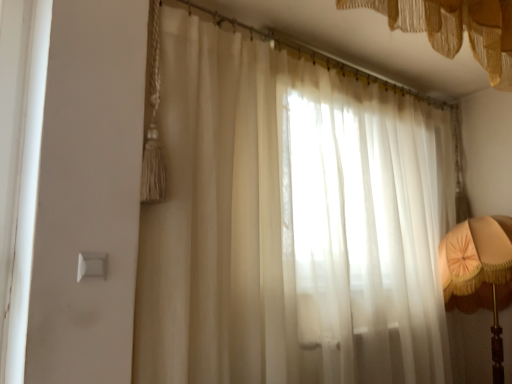
Question: Could you tell me if white plastic light switch at lower left is turned towards sheer white curtain at center, the 1th curtain from the bottom?

Choices:
 (A) yes
 (B) no

Answer: (B)

Question: From the image's perspective, is white plastic light switch at lower left located beneath sheer white curtain at center, the 1th curtain from the bottom?

Choices:
 (A) no
 (B) yes

Answer: (B)

Question: Would you say white plastic light switch at lower left is a long distance from sheer white curtain at center, the 1th curtain from the bottom?

Choices:
 (A) yes
 (B) no

Answer: (B)

Question: Is white plastic light switch at lower left positioned with its back to sheer white curtain at center, the 1th curtain from the bottom?

Choices:
 (A) yes
 (B) no

Answer: (B)

Question: From the image's perspective, is white plastic light switch at lower left above sheer white curtain at center, which appears as the 2th curtain when viewed from the top?

Choices:
 (A) no
 (B) yes

Answer: (A)

Question: Is white plastic light switch at lower left not inside sheer white curtain at center, which appears as the 2th curtain when viewed from the top?

Choices:
 (A) yes
 (B) no

Answer: (A)

Question: Does matte orange fabric lampshade at right have a lesser width compared to translucent fabric curtain at upper center, the 1th curtain positioned from the top?

Choices:
 (A) yes
 (B) no

Answer: (B)

Question: Is matte orange fabric lampshade at right to the left of translucent fabric curtain at upper center, which is the 2th curtain from bottom to top, from the viewer's perspective?

Choices:
 (A) no
 (B) yes

Answer: (A)

Question: Is translucent fabric curtain at upper center, which is the 2th curtain from bottom to top, surrounded by matte orange fabric lampshade at right?

Choices:
 (A) yes
 (B) no

Answer: (B)

Question: Does matte orange fabric lampshade at right appear on the right side of translucent fabric curtain at upper center, which is the 2th curtain from bottom to top?

Choices:
 (A) no
 (B) yes

Answer: (B)

Question: Considering the relative positions of matte orange fabric lampshade at right and translucent fabric curtain at upper center, which is the 2th curtain from bottom to top, in the image provided, is matte orange fabric lampshade at right in front of translucent fabric curtain at upper center, which is the 2th curtain from bottom to top,?

Choices:
 (A) yes
 (B) no

Answer: (B)

Question: From the image's perspective, is matte orange fabric lampshade at right located above translucent fabric curtain at upper center, which is the 2th curtain from bottom to top?

Choices:
 (A) yes
 (B) no

Answer: (B)

Question: From the image's perspective, is matte orange fabric lampshade at right over sheer white curtain at center, which appears as the 2th curtain when viewed from the top?

Choices:
 (A) yes
 (B) no

Answer: (B)